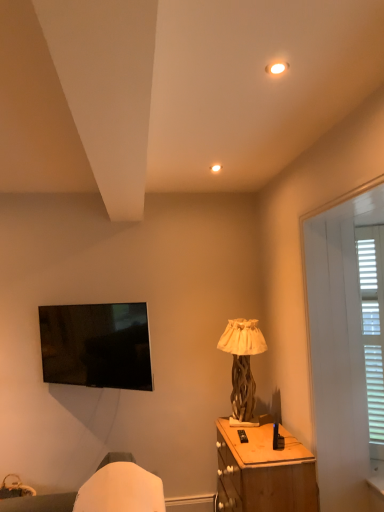
Question: Considering their positions, is matte white light fixture at upper center located in front of or behind wooden textured lamp at center?

Choices:
 (A) behind
 (B) front

Answer: (B)

Question: Would you say matte white light fixture at upper center is to the left or to the right of wooden textured lamp at center in the picture?

Choices:
 (A) right
 (B) left

Answer: (B)

Question: Which object is positioned closest to the white wood screen door at right?

Choices:
 (A) matte white light fixture at upper center
 (B) wooden nightstand at lower right
 (C) white wooden blinds at right
 (D) wooden textured lamp at center

Answer: (C)

Question: Which is nearer to the wooden textured lamp at center?

Choices:
 (A) white wood screen door at right
 (B) matte white light fixture at upper center
 (C) wooden nightstand at lower right
 (D) white wooden blinds at right

Answer: (C)